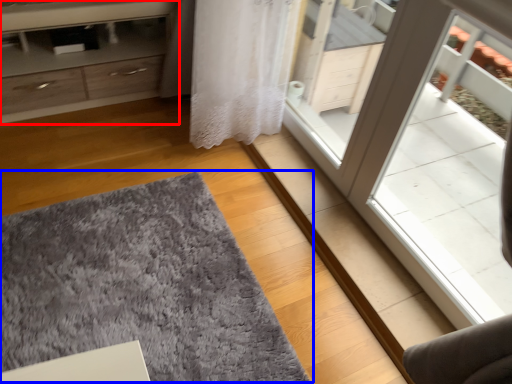
Question: Which of the following is the farthest to the observer, chest of drawers (highlighted by a red box) or doormat (highlighted by a blue box)?

Choices:
 (A) chest of drawers
 (B) doormat

Answer: (A)